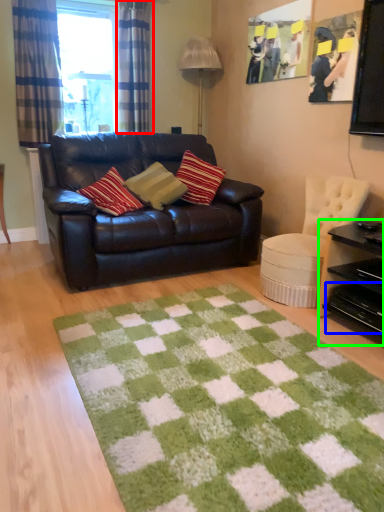
Question: Which is farther away from curtain (highlighted by a red box)? drawer (highlighted by a blue box) or table (highlighted by a green box)?

Choices:
 (A) drawer
 (B) table

Answer: (A)